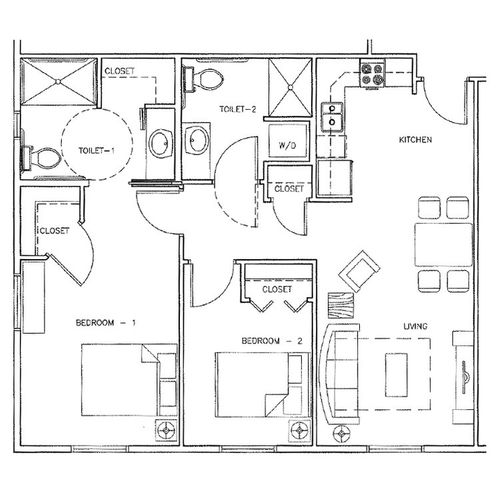
Find the location of a particular element. second bed is located at coordinates (236, 377), (272, 367), (253, 390).